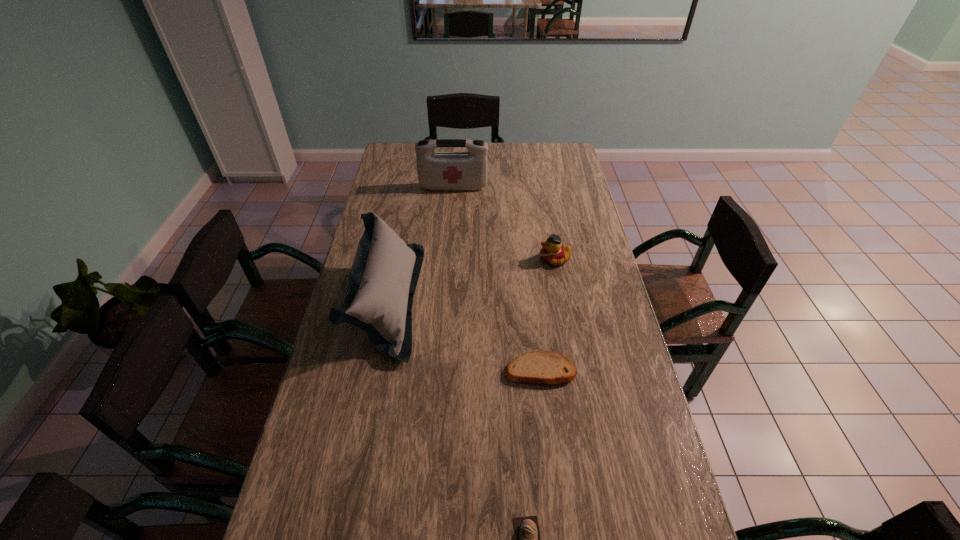
The image size is (960, 540). Find the location of `the first-aid kit`. the first-aid kit is located at coordinates (439, 171).

Locate an element on the screen. The image size is (960, 540). cushion is located at coordinates (382, 281).

In order to click on the third shortest object in this screenshot , I will do `click(553, 252)`.

Locate an element on the screen. The image size is (960, 540). the farther pita bread is located at coordinates (537, 367).

In order to click on free space located 0.230m on the front side of the farthest object in this screenshot , I will do click(450, 225).

Image resolution: width=960 pixels, height=540 pixels. I want to click on vacant space located on the surface of the cushion, so click(473, 300).

The height and width of the screenshot is (540, 960). Identify the location of vacant region located on the face of the duck. (490, 259).

Image resolution: width=960 pixels, height=540 pixels. I want to click on vacant space located 0.240m on the face of the duck, so click(473, 259).

The height and width of the screenshot is (540, 960). I want to click on vacant space positioned on the face of the duck, so click(x=465, y=259).

The height and width of the screenshot is (540, 960). Identify the location of vacant space situated 0.230m on the front of the farther pita bread. (551, 470).